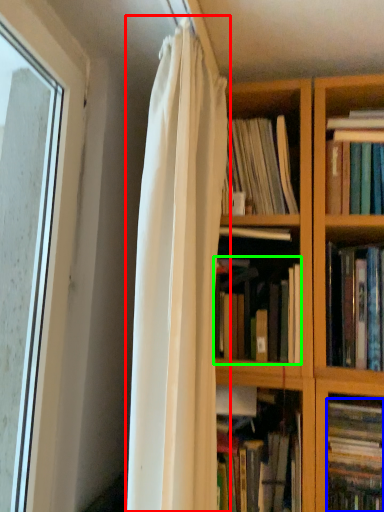
Question: Which object is positioned closest to curtain (highlighted by a red box)? Select from book (highlighted by a blue box) and book (highlighted by a green box).

Choices:
 (A) book
 (B) book

Answer: (B)